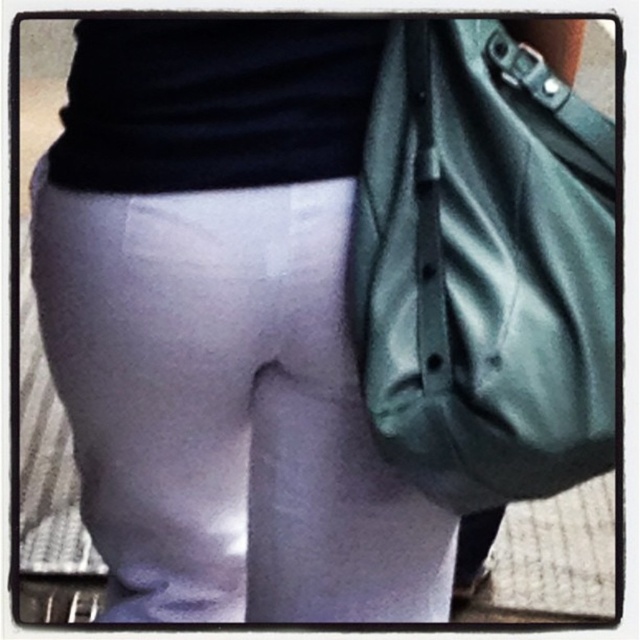
Can you confirm if matte white leggings at center is smaller than matte green shoulder bag at right?

Actually, matte white leggings at center might be larger than matte green shoulder bag at right.

Does matte white leggings at center have a larger size compared to matte green shoulder bag at right?

Indeed, matte white leggings at center has a larger size compared to matte green shoulder bag at right.

Is point (163, 342) more distant than point (586, 260)?

Yes, point (163, 342) is behind point (586, 260).

You are a GUI agent. You are given a task and a screenshot of the screen. Output one action in this format:
    pyautogui.click(x=<x>, y=<y>)
    Task: Click on the matte white leggings at center
    The height and width of the screenshot is (640, 640).
    Given the screenshot: What is the action you would take?
    pyautogui.click(x=227, y=410)